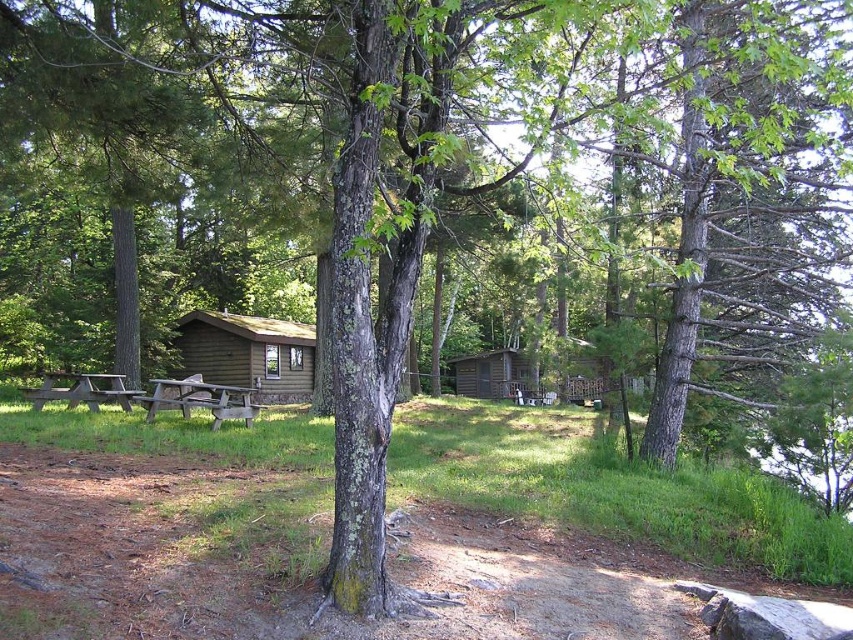
Can you confirm if wooden cabin at center is positioned below wooden picnic table at lower left?

Actually, wooden cabin at center is above wooden picnic table at lower left.

What are the coordinates of `wooden cabin at center` in the screenshot? It's located at (248, 353).

The height and width of the screenshot is (640, 853). In order to click on wooden cabin at center in this screenshot , I will do `click(248, 353)`.

Can you confirm if wooden cabin at center is bigger than brown wooden picnic table at left?

Indeed, wooden cabin at center has a larger size compared to brown wooden picnic table at left.

Does wooden cabin at center lie in front of brown wooden picnic table at left?

No, it is behind brown wooden picnic table at left.

This screenshot has height=640, width=853. Describe the element at coordinates (248, 353) in the screenshot. I see `wooden cabin at center` at that location.

The width and height of the screenshot is (853, 640). I want to click on wooden cabin at center, so click(248, 353).

Does wooden picnic table at lower left come behind brown wooden picnic table at left?

No, it is in front of brown wooden picnic table at left.

Does wooden picnic table at lower left have a lesser height compared to brown wooden picnic table at left?

No, wooden picnic table at lower left is not shorter than brown wooden picnic table at left.

Between point (231, 410) and point (78, 385), which one is positioned in front?

Point (231, 410) is more forward.

Locate an element on the screen. Image resolution: width=853 pixels, height=640 pixels. wooden picnic table at lower left is located at coordinates (200, 400).